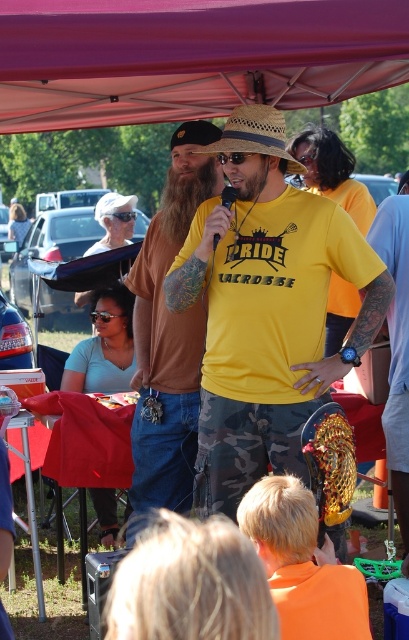
You are organizing a photo shoot and want to ensure that the two main subjects, the yellow matte shirt at center and the brownwoodybeard at center, are framed properly. Based on their sizes, which subject should be placed closer to the camera to maintain proportion?

The yellow matte shirt at center is larger in width than the brownwoodybeard at center. To maintain proportion, the brownwoodybeard at center should be placed closer to the camera so that both appear similarly sized in the photo.